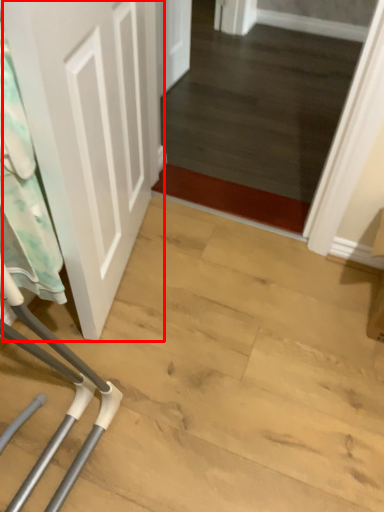
Question: From the image's perspective, what is the correct spatial relationship of door (annotated by the red box) in relation to laundry?

Choices:
 (A) above
 (B) below

Answer: (A)